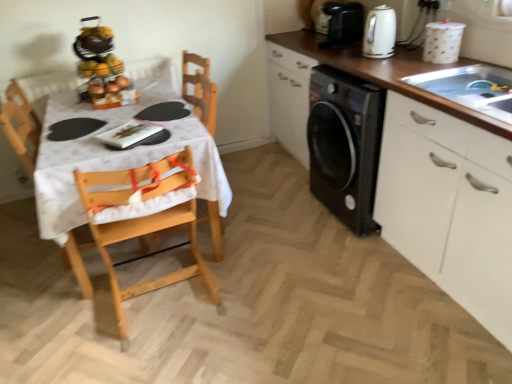
I want to click on white glossy canister at upper right, which ranks as the second appliance in back-to-front order, so tap(442, 42).

How much space does matte black coffee maker at upper right, which is the second appliance in front-to-back order, occupy horizontally?

The width of matte black coffee maker at upper right, which is the second appliance in front-to-back order, is 14.05 inches.

Describe the element at coordinates (144, 220) in the screenshot. I see `wooden highchair at left` at that location.

Image resolution: width=512 pixels, height=384 pixels. In order to click on white glossy kettle at upper right in this screenshot , I will do `click(379, 33)`.

What do you see at coordinates (115, 157) in the screenshot? I see `white fabric tablecloth at left` at bounding box center [115, 157].

In order to click on white glossy canister at upper right, the 1th appliance viewed from the front in this screenshot , I will do `click(442, 42)`.

Looking at this image, is silver metallic sink at upper right completely or partially inside matte black coffee maker at upper right, which is the first appliance from top to bottom?

Actually, silver metallic sink at upper right is outside matte black coffee maker at upper right, which is the first appliance from top to bottom.

Are matte black coffee maker at upper right, which is the second appliance in front-to-back order, and silver metallic sink at upper right located far from each other?

No, matte black coffee maker at upper right, which is the second appliance in front-to-back order, is not far from silver metallic sink at upper right.

From the picture: Can you tell me how much matte black coffee maker at upper right, the 2th appliance positioned from the right, and silver metallic sink at upper right differ in facing direction?

There is a 4.24e-05-degree angle between the facing directions of matte black coffee maker at upper right, the 2th appliance positioned from the right, and silver metallic sink at upper right.

Is there a large distance between white glossy cabinet at right and shiny plastic fruit basket at upper left?

Absolutely, white glossy cabinet at right is distant from shiny plastic fruit basket at upper left.

From a real-world perspective, is white glossy cabinet at right located beneath shiny plastic fruit basket at upper left?

Yes, from a real-world perspective, white glossy cabinet at right is under shiny plastic fruit basket at upper left.

Does white glossy cabinet at right turn towards shiny plastic fruit basket at upper left?

Yes, white glossy cabinet at right is facing shiny plastic fruit basket at upper left.

Between white glossy cabinet at right and shiny plastic fruit basket at upper left, which one has smaller size?

shiny plastic fruit basket at upper left is smaller.

Based on the photo, from the image's perspective, is silver metallic sink at upper right positioned above or below white glossy kettle at upper right?

silver metallic sink at upper right is situated lower than white glossy kettle at upper right in the image.

Where is `sink below the white glossy kettle at upper right (from a real-world perspective)`? The width and height of the screenshot is (512, 384). sink below the white glossy kettle at upper right (from a real-world perspective) is located at coordinates (471, 88).

Can you confirm if silver metallic sink at upper right is shorter than white glossy kettle at upper right?

Result: Yes, silver metallic sink at upper right is shorter than white glossy kettle at upper right.

Considering the positions of point (500, 78) and point (378, 14), is point (500, 78) closer or farther from the camera than point (378, 14)?

Point (500, 78) appears to be closer to the viewer than point (378, 14).

Find the location of `the 2nd appliance above the shiny plastic fruit basket at upper left (from the image's perspective)`. the 2nd appliance above the shiny plastic fruit basket at upper left (from the image's perspective) is located at coordinates (343, 23).

Is matte black coffee maker at upper right, acting as the second appliance starting from the bottom, inside or outside of shiny plastic fruit basket at upper left?

matte black coffee maker at upper right, acting as the second appliance starting from the bottom, exists outside the volume of shiny plastic fruit basket at upper left.

Locate an element on the screen. chair located below the white glossy cabinet at right (from the image's perspective) is located at coordinates click(x=144, y=220).

Can you tell me how much wooden highchair at left and white glossy cabinet at right differ in facing direction?

The angular difference between wooden highchair at left and white glossy cabinet at right is 90 degrees.

Based on their sizes in the image, would you say wooden highchair at left is bigger or smaller than white glossy cabinet at right?

Clearly, wooden highchair at left is smaller in size than white glossy cabinet at right.

From a real-world perspective, is wooden highchair at left under white glossy cabinet at right?

Yes, from a real-world perspective, wooden highchair at left is beneath white glossy cabinet at right.

Between shiny plastic fruit basket at upper left and white fabric tablecloth at left, which one has more height?

Standing taller between the two is white fabric tablecloth at left.

Considering the relative positions of shiny plastic fruit basket at upper left and white fabric tablecloth at left in the image provided, is shiny plastic fruit basket at upper left in front of white fabric tablecloth at left?

No, shiny plastic fruit basket at upper left is further to the viewer.

From a real-world perspective, is shiny plastic fruit basket at upper left physically located above or below white fabric tablecloth at left?

From a real-world perspective, shiny plastic fruit basket at upper left is physically above white fabric tablecloth at left.

Is shiny plastic fruit basket at upper left looking in the opposite direction of white fabric tablecloth at left?

No, white fabric tablecloth at left is not at the back of shiny plastic fruit basket at upper left.

Between white glossy canister at upper right, the 1th appliance from the bottom, and white fabric tablecloth at left, which one appears on the left side from the viewer's perspective?

From the viewer's perspective, white fabric tablecloth at left appears more on the left side.

How many degrees apart are the facing directions of white glossy canister at upper right, the 1th appliance viewed from the front, and white fabric tablecloth at left?

There is a 90-degree angle between the facing directions of white glossy canister at upper right, the 1th appliance viewed from the front, and white fabric tablecloth at left.

Is white glossy canister at upper right, marked as the first appliance in a right-to-left arrangement, spatially inside white fabric tablecloth at left, or outside of it?

white glossy canister at upper right, marked as the first appliance in a right-to-left arrangement, cannot be found inside white fabric tablecloth at left.

How distant is white glossy canister at upper right, which ranks as the second appliance in back-to-front order, from white fabric tablecloth at left?

1.54 meters.

Locate an element on the screen. The width and height of the screenshot is (512, 384). sink that appears on the right of matte black coffee maker at upper right, the 2th appliance positioned from the right is located at coordinates tap(471, 88).

This screenshot has height=384, width=512. What are the coordinates of `cabinetry below the shiny plastic fruit basket at upper left (from the image's perspective)` in the screenshot? It's located at (437, 181).

Looking at the image, which one is located further to white glossy canister at upper right, the 1th appliance from the bottom, white fabric tablecloth at left or wooden highchair at left?

Based on the image, wooden highchair at left appears to be further to white glossy canister at upper right, the 1th appliance from the bottom.

From the image, which object appears to be farther from white glossy canister at upper right, the 1th appliance viewed from the front, white fabric tablecloth at left or matte black coffee maker at upper right, the 2th appliance positioned from the right?

Among the two, white fabric tablecloth at left is located further to white glossy canister at upper right, the 1th appliance viewed from the front.

Which object lies nearer to the anchor point matte black coffee maker at upper right, which ranks as the 1th appliance in back-to-front order, white fabric tablecloth at left or wooden highchair at left?

Based on the image, white fabric tablecloth at left appears to be nearer to matte black coffee maker at upper right, which ranks as the 1th appliance in back-to-front order.

In the scene shown: From the image, which object appears to be nearer to white glossy cabinet at right, white glossy kettle at upper right or silver metallic sink at upper right?

The object closer to white glossy cabinet at right is silver metallic sink at upper right.

Which object lies nearer to the anchor point matte black coffee maker at upper right, acting as the second appliance starting from the bottom, white glossy cabinet at right or silver metallic sink at upper right?

silver metallic sink at upper right lies closer to matte black coffee maker at upper right, acting as the second appliance starting from the bottom, than the other object.

When comparing their distances from wooden highchair at left, does matte black coffee maker at upper right, the 2th appliance positioned from the right, or white fabric tablecloth at left seem closer?

Based on the image, white fabric tablecloth at left appears to be nearer to wooden highchair at left.

From the picture: Based on their spatial positions, is white glossy canister at upper right, the 2th appliance viewed from the left, or white glossy kettle at upper right further from wooden highchair at left?

white glossy canister at upper right, the 2th appliance viewed from the left, lies further to wooden highchair at left than the other object.

Which object lies nearer to the anchor point shiny plastic fruit basket at upper left, white glossy kettle at upper right or white glossy canister at upper right, the 2th appliance viewed from the left?

white glossy kettle at upper right lies closer to shiny plastic fruit basket at upper left than the other object.

The height and width of the screenshot is (384, 512). In order to click on kitchen appliance between wooden highchair at left and white glossy cabinet at right in this screenshot , I will do `click(379, 33)`.

The image size is (512, 384). In order to click on chair between white fabric tablecloth at left and matte black coffee maker at upper right, the 2th appliance positioned from the right, from left to right in this screenshot , I will do `click(144, 220)`.

Where is `cabinetry located between shiny plastic fruit basket at upper left and white glossy canister at upper right, which ranks as the second appliance in back-to-front order, in the left-right direction`? This screenshot has width=512, height=384. cabinetry located between shiny plastic fruit basket at upper left and white glossy canister at upper right, which ranks as the second appliance in back-to-front order, in the left-right direction is located at coordinates (437, 181).

Where is `kitchen appliance located between white fabric tablecloth at left and silver metallic sink at upper right in the left-right direction`? Image resolution: width=512 pixels, height=384 pixels. kitchen appliance located between white fabric tablecloth at left and silver metallic sink at upper right in the left-right direction is located at coordinates (379, 33).